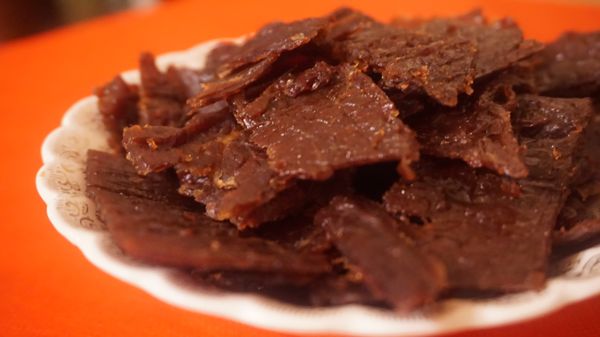
What are the coordinates of `white plate` in the screenshot? It's located at (252, 307).